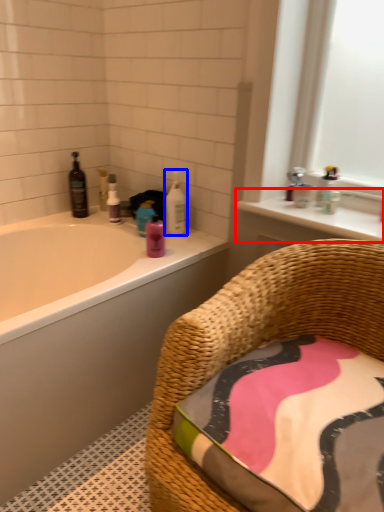
Question: Which object is further to the camera taking this photo, window sill (highlighted by a red box) or cleaning product (highlighted by a blue box)?

Choices:
 (A) window sill
 (B) cleaning product

Answer: (B)